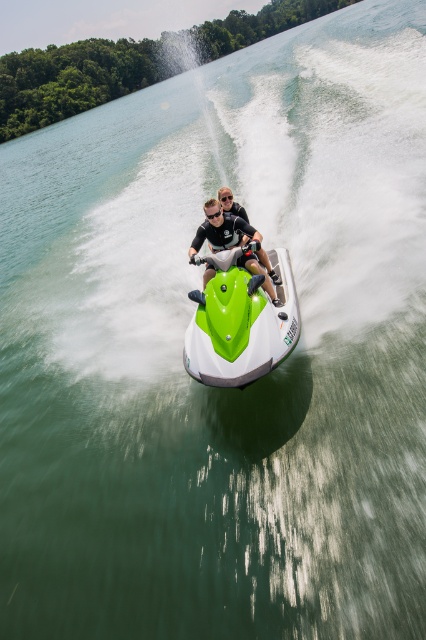
Can you confirm if green matte jet ski at center is shorter than matte black helmet at center?

Incorrect, green matte jet ski at center's height does not fall short of matte black helmet at center's.

Is the position of green matte jet ski at center more distant than that of matte black helmet at center?

No, green matte jet ski at center is closer to the viewer.

Which is behind, point (244, 314) or point (233, 228)?

Positioned behind is point (233, 228).

I want to click on green matte jet ski at center, so click(x=241, y=326).